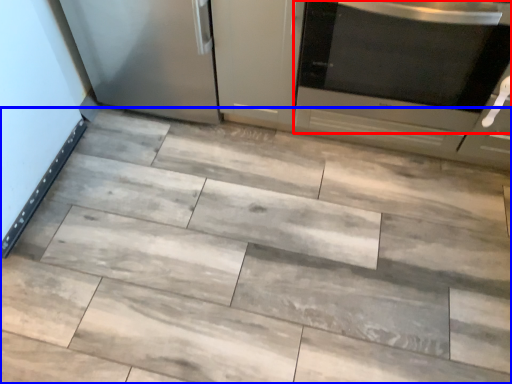
Question: Among these objects, which one is nearest to the camera, home appliance (highlighted by a red box) or ceramic tile (highlighted by a blue box)?

Choices:
 (A) home appliance
 (B) ceramic tile

Answer: (B)